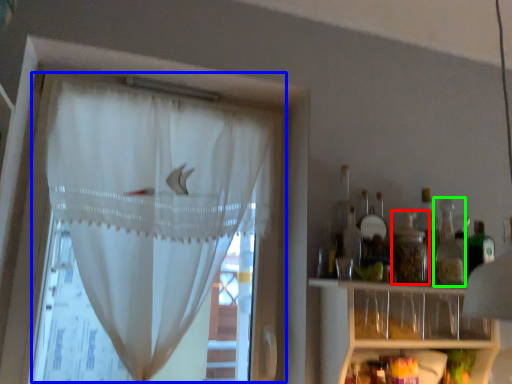
Question: Considering the real-world distances, which object is closest to bottle (highlighted by a red box)? curtain (highlighted by a blue box) or bottle (highlighted by a green box).

Choices:
 (A) curtain
 (B) bottle

Answer: (B)